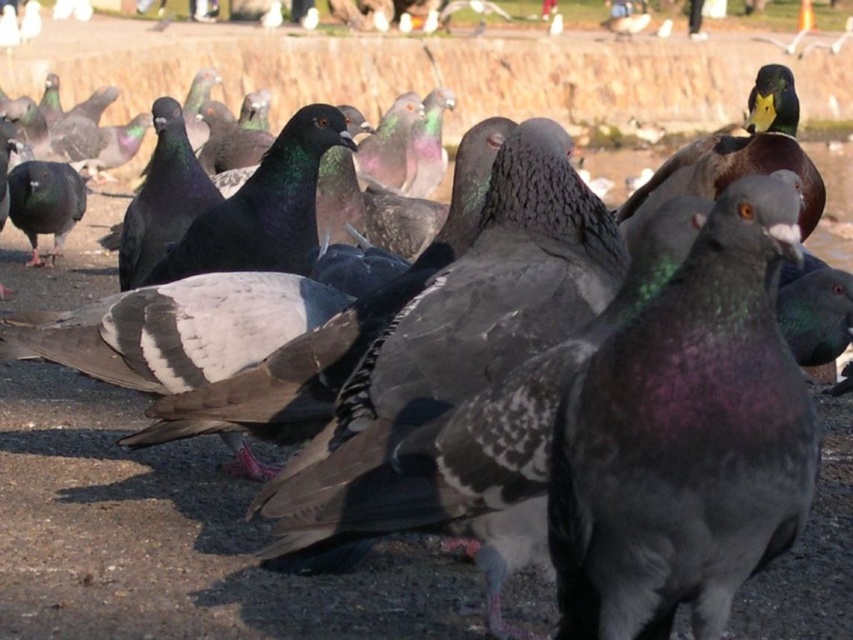
Which is in front, point (596, 385) or point (650, 193)?

Point (596, 385)

At what (x,y) coordinates should I click in order to perform the action: click on shiny gray pigeon at center. Please return your answer as a coordinate pair (x, y). The width and height of the screenshot is (853, 640). Looking at the image, I should click on (685, 436).

Identify the location of shiny gray pigeon at center. Image resolution: width=853 pixels, height=640 pixels. (685, 436).